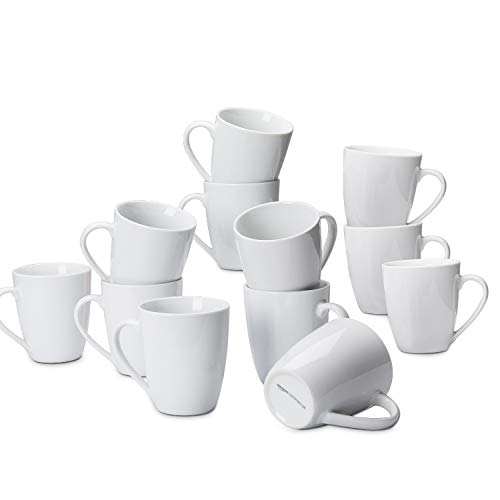
Where is `unstacked mugs`? unstacked mugs is located at coordinates (43, 316), (184, 362), (348, 357), (436, 294).